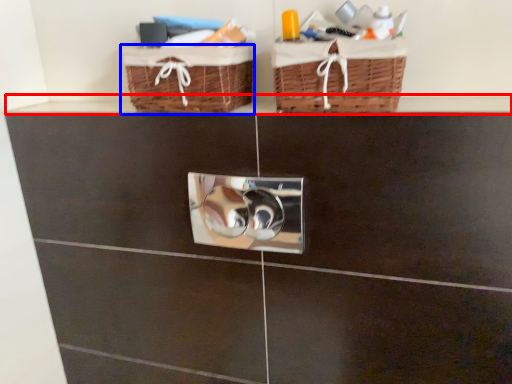
Question: Among these objects, which one is farthest to the camera, ledge (highlighted by a red box) or basket (highlighted by a blue box)?

Choices:
 (A) ledge
 (B) basket

Answer: (B)